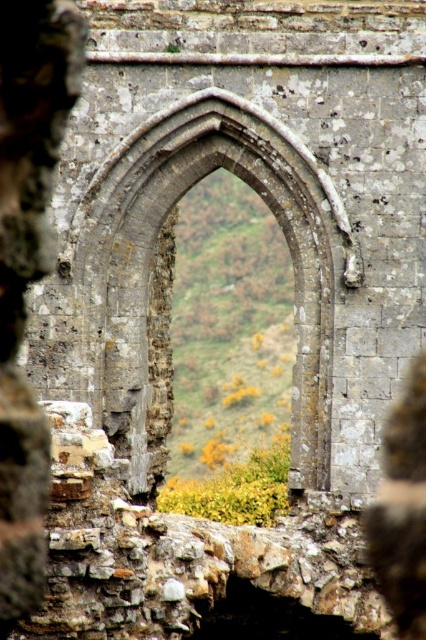
Question: Is stone archway at center positioned in front of smooth stone wall at center?

Choices:
 (A) yes
 (B) no

Answer: (B)

Question: Can you confirm if stone archway at center is wider than smooth stone wall at center?

Choices:
 (A) yes
 (B) no

Answer: (A)

Question: Which point is farther from the camera taking this photo?

Choices:
 (A) (112, 227)
 (B) (420, 545)

Answer: (A)

Question: Which point is closer to the camera?

Choices:
 (A) (368, 515)
 (B) (123, 253)

Answer: (A)

Question: Considering the relative positions of stone archway at center and smooth stone wall at center in the image provided, where is stone archway at center located with respect to smooth stone wall at center?

Choices:
 (A) above
 (B) below

Answer: (A)